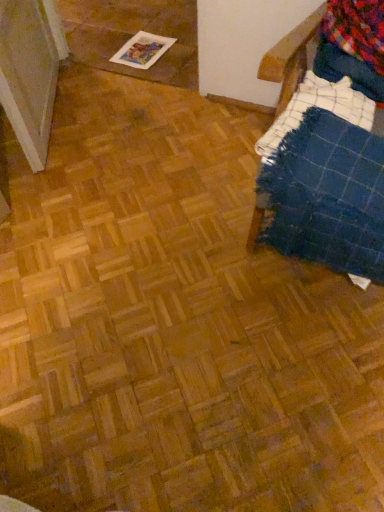
Question: Is multicolored flannel at upper right in front of or behind blue plaid blanket at right in the image?

Choices:
 (A) front
 (B) behind

Answer: (B)

Question: Would you say multicolored flannel at upper right is to the left or to the right of blue plaid blanket at right in the picture?

Choices:
 (A) right
 (B) left

Answer: (B)

Question: Based on their relative distances, which object is nearer to the printed paper magazine at upper left?

Choices:
 (A) blue plaid blanket at right
 (B) multicolored flannel at upper right

Answer: (B)

Question: Estimate the real-world distances between objects in this image. Which object is farther from the blue plaid blanket at right?

Choices:
 (A) printed paper magazine at upper left
 (B) multicolored flannel at upper right

Answer: (A)